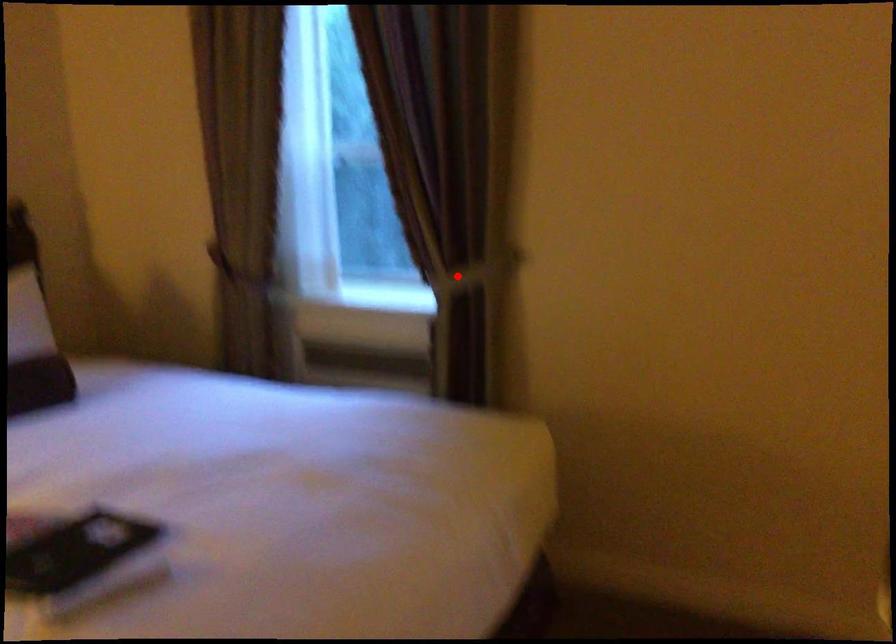
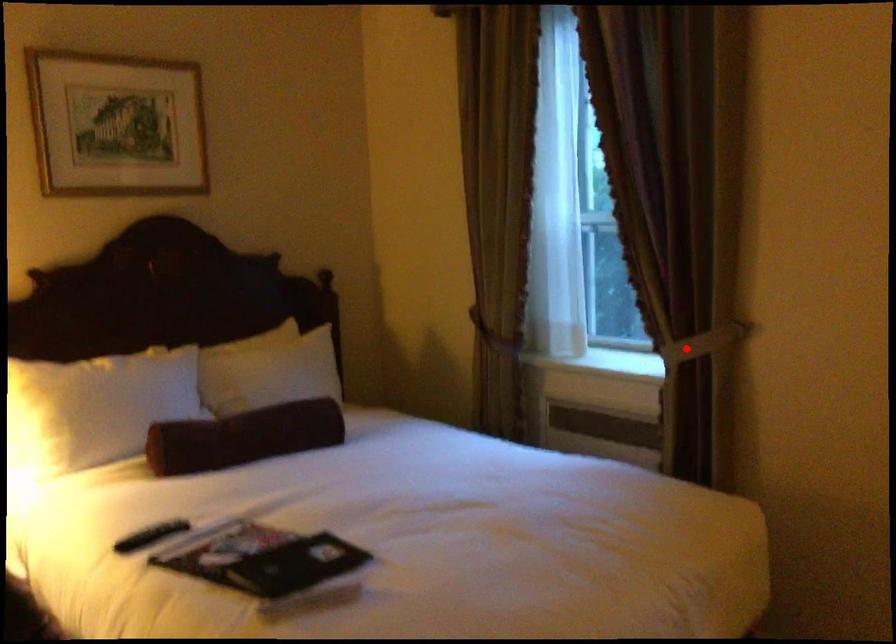
I am providing you with two images of the same scene from different viewpoints. A red point is marked on the first image and another point is marked on the second image. Is the red point in image1 aligned with the point shown in image2?

Yes